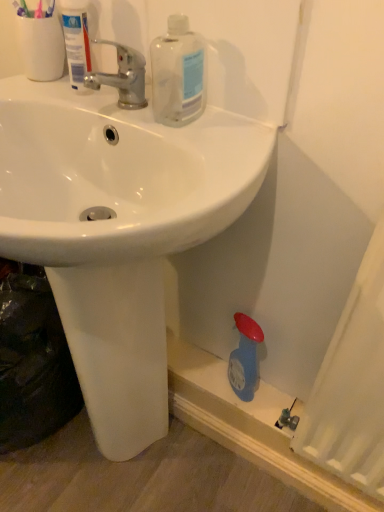
The image size is (384, 512). Find the location of `vacant area that lies between chrome metallic faucet at upper center and white plastic tube at upper left`. vacant area that lies between chrome metallic faucet at upper center and white plastic tube at upper left is located at coordinates (85, 101).